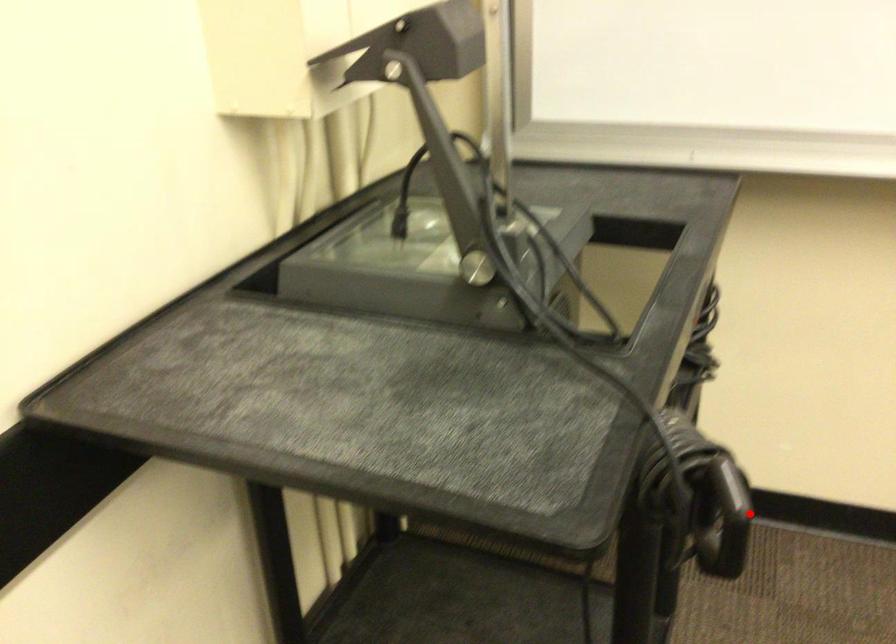
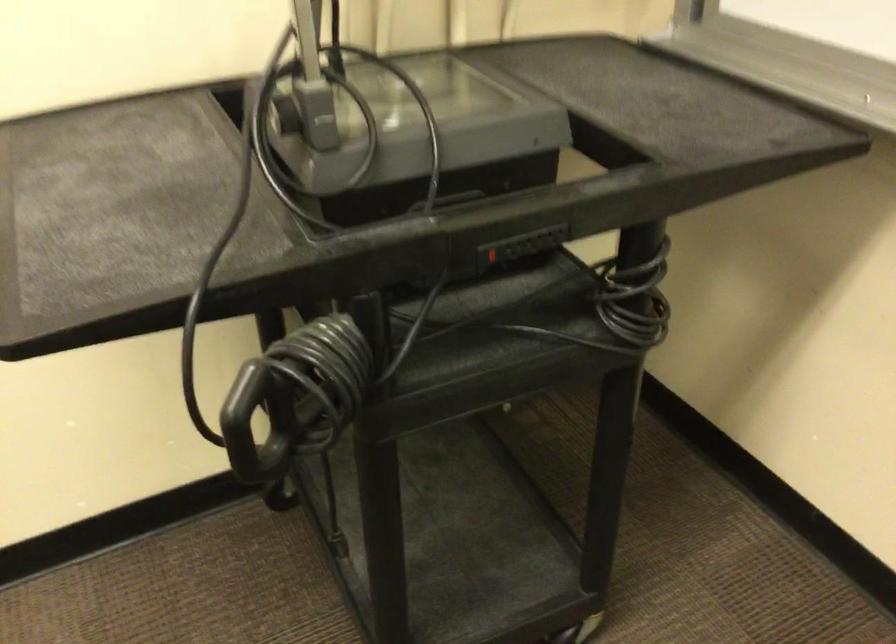
The point at the highlighted location is marked in the first image. Where is the corresponding point in the second image?

(247, 418)